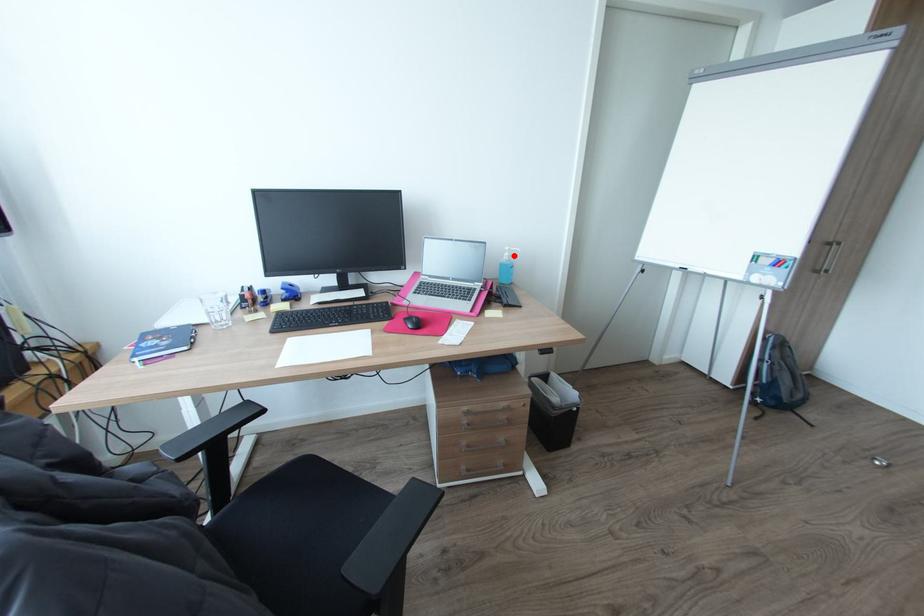
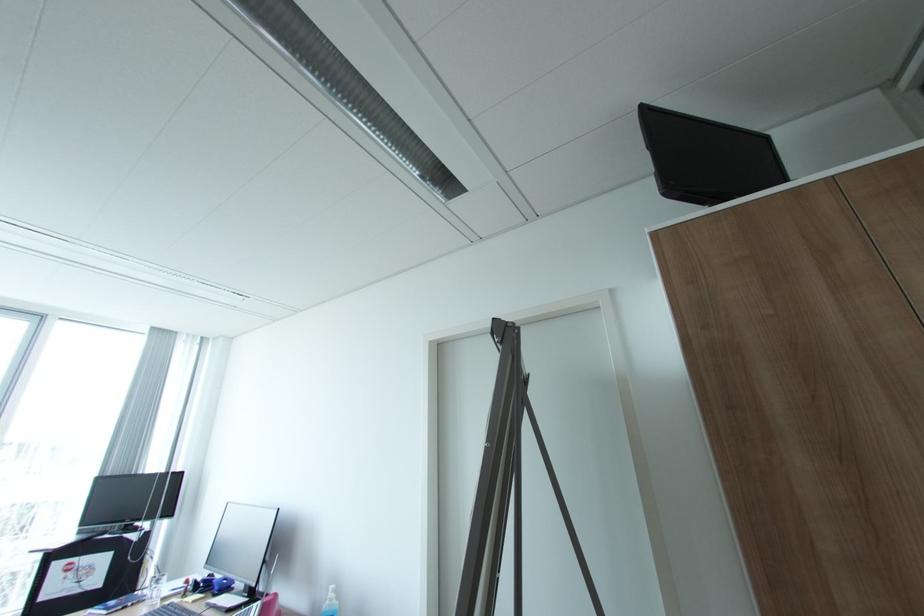
Find the pixel in the second image that matches the highlighted location in the first image.

(336, 599)